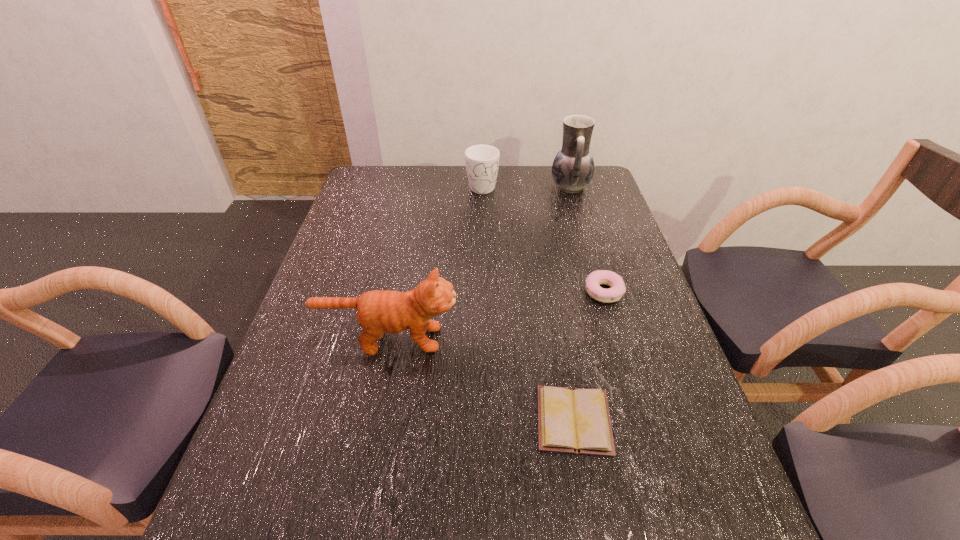
Identify the location of free space located 0.210m on the front-facing side of the pitcher. (492, 187).

This screenshot has height=540, width=960. Identify the location of vacant area located 0.380m on the front-facing side of the pitcher. (446, 187).

At what (x,y) coordinates should I click in order to perform the action: click on free space located 0.190m on the face of the cat. Please return your answer as a coordinate pair (x, y). Image resolution: width=960 pixels, height=540 pixels. Looking at the image, I should click on coord(536,339).

At what (x,y) coordinates should I click in order to perform the action: click on free space located on the side of the third tallest object with the handle. Please return your answer as a coordinate pair (x, y). Image resolution: width=960 pixels, height=540 pixels. Looking at the image, I should click on (482, 208).

This screenshot has width=960, height=540. What are the coordinates of `free space located on the back of the third nearest object` in the screenshot? It's located at tap(584, 225).

The width and height of the screenshot is (960, 540). I want to click on free spot located 0.250m on the left of the diary, so click(416, 420).

Locate an element on the screen. The image size is (960, 540). pitcher at the far edge is located at coordinates (573, 167).

Locate an element on the screen. The width and height of the screenshot is (960, 540). mug that is at the far edge is located at coordinates (482, 161).

Identify the location of object at the left edge. (378, 311).

Find the location of a particular element. pitcher situated at the right edge is located at coordinates (573, 167).